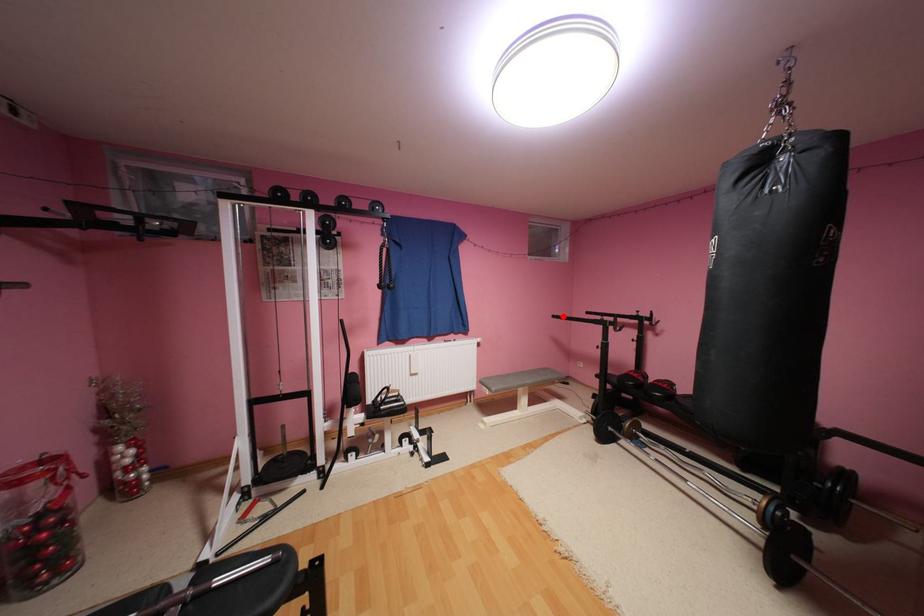
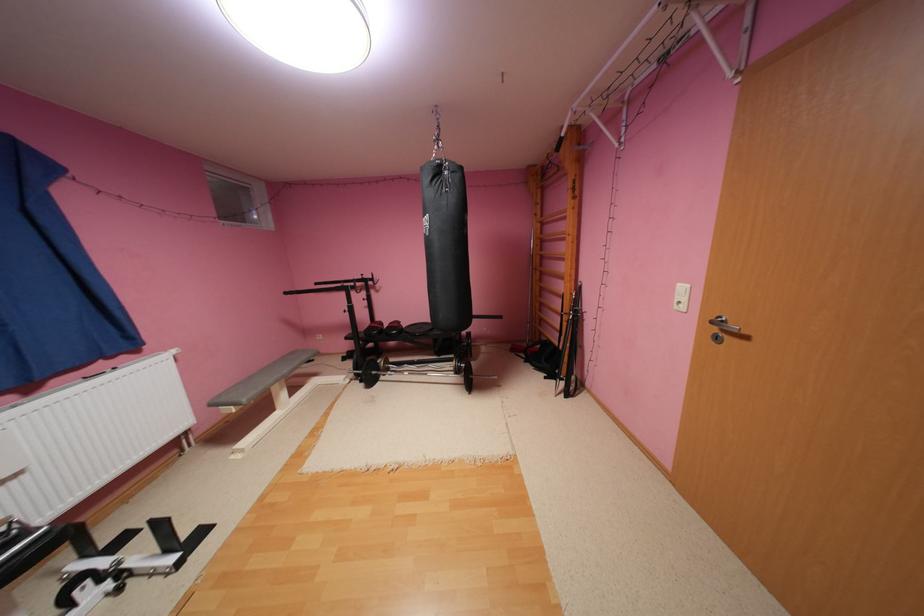
Where in the second image is the point corresponding to the highlighted location from the first image?

(295, 293)